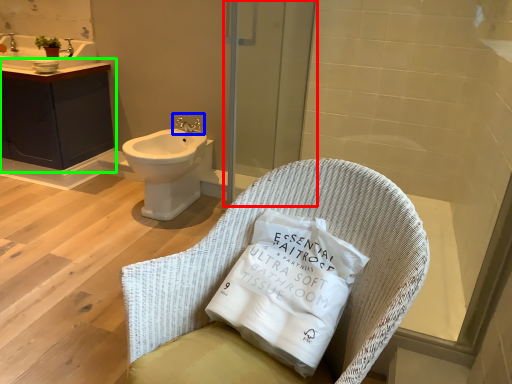
Question: Which object is positioned farthest from screen door (highlighted by a red box)? Select from tap (highlighted by a blue box) and bathroom cabinet (highlighted by a green box).

Choices:
 (A) tap
 (B) bathroom cabinet

Answer: (B)